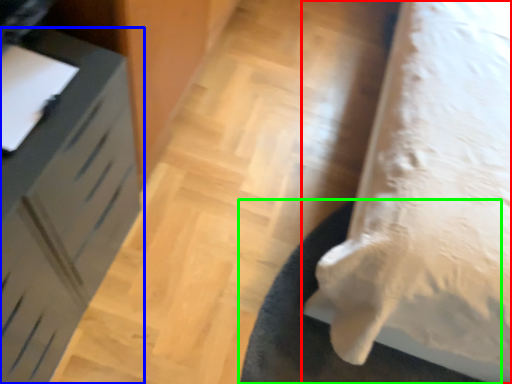
Question: Which object is positioned closest to furniture (highlighted by a red box)? Select from furniture (highlighted by a blue box) and mat (highlighted by a green box).

Choices:
 (A) furniture
 (B) mat

Answer: (B)